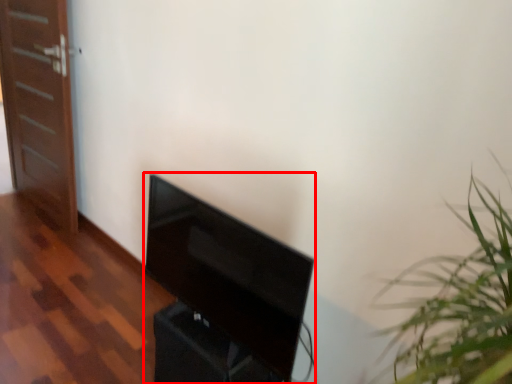
Question: From the image's perspective, where is furniture (annotated by the red box) located relative to door?

Choices:
 (A) below
 (B) above

Answer: (A)